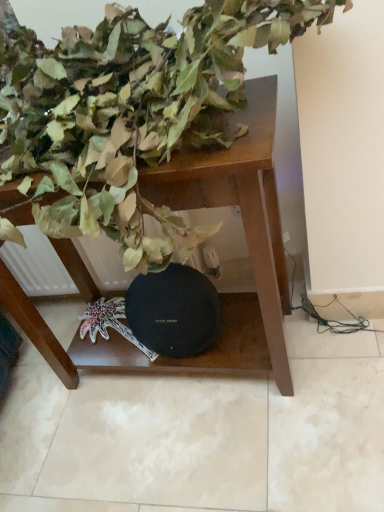
Question: Is green matte leaves at upper left looking in the opposite direction of brown wooden table at center?

Choices:
 (A) no
 (B) yes

Answer: (A)

Question: Does green matte leaves at upper left have a greater width compared to brown wooden table at center?

Choices:
 (A) yes
 (B) no

Answer: (A)

Question: Are green matte leaves at upper left and brown wooden table at center located far from each other?

Choices:
 (A) no
 (B) yes

Answer: (A)

Question: From a real-world perspective, is green matte leaves at upper left on top of brown wooden table at center?

Choices:
 (A) no
 (B) yes

Answer: (B)

Question: Is green matte leaves at upper left not within brown wooden table at center?

Choices:
 (A) no
 (B) yes

Answer: (B)

Question: Considering the relative sizes of green matte leaves at upper left and brown wooden table at center in the image provided, is green matte leaves at upper left smaller than brown wooden table at center?

Choices:
 (A) no
 (B) yes

Answer: (A)

Question: From the image's perspective, is brown wooden table at center above green matte leaves at upper left?

Choices:
 (A) no
 (B) yes

Answer: (A)

Question: Is brown wooden table at center looking in the opposite direction of green matte leaves at upper left?

Choices:
 (A) yes
 (B) no

Answer: (B)

Question: Is brown wooden table at center in front of green matte leaves at upper left?

Choices:
 (A) no
 (B) yes

Answer: (A)

Question: Can you confirm if brown wooden table at center is shorter than green matte leaves at upper left?

Choices:
 (A) no
 (B) yes

Answer: (A)

Question: Is brown wooden table at center outside of green matte leaves at upper left?

Choices:
 (A) yes
 (B) no

Answer: (A)

Question: Is brown wooden table at center thinner than green matte leaves at upper left?

Choices:
 (A) no
 (B) yes

Answer: (B)

Question: Is green matte leaves at upper left spatially inside brown wooden table at center, or outside of it?

Choices:
 (A) inside
 (B) outside

Answer: (B)